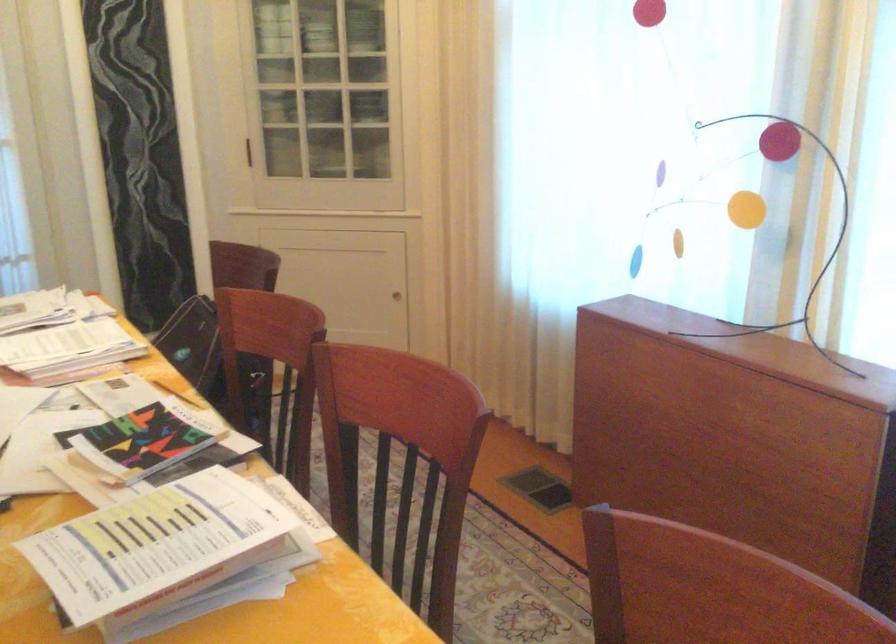
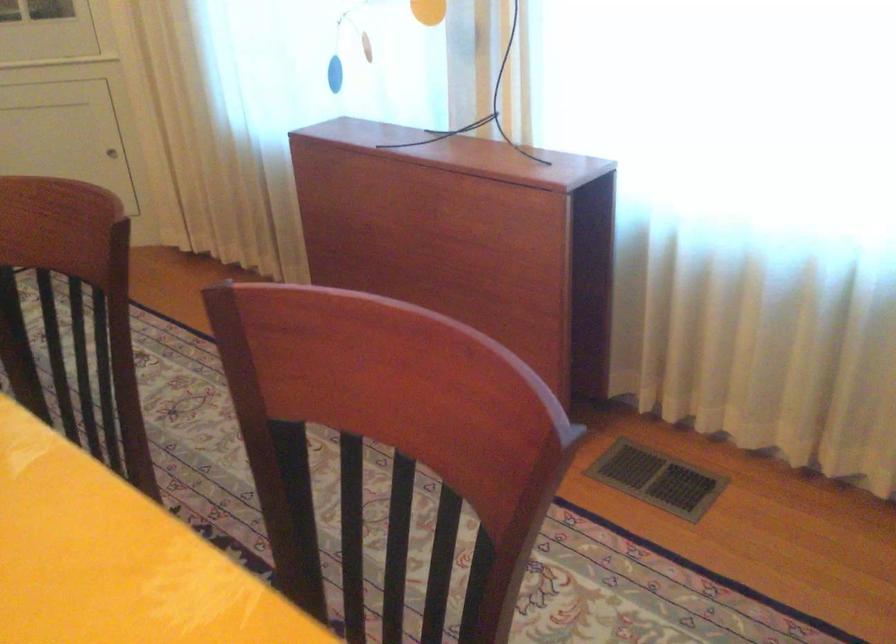
Question: What movement of the cameraman would produce the second image?

Choices:
 (A) Left
 (B) Right
 (C) Forward
 (D) Backward

Answer: (B)